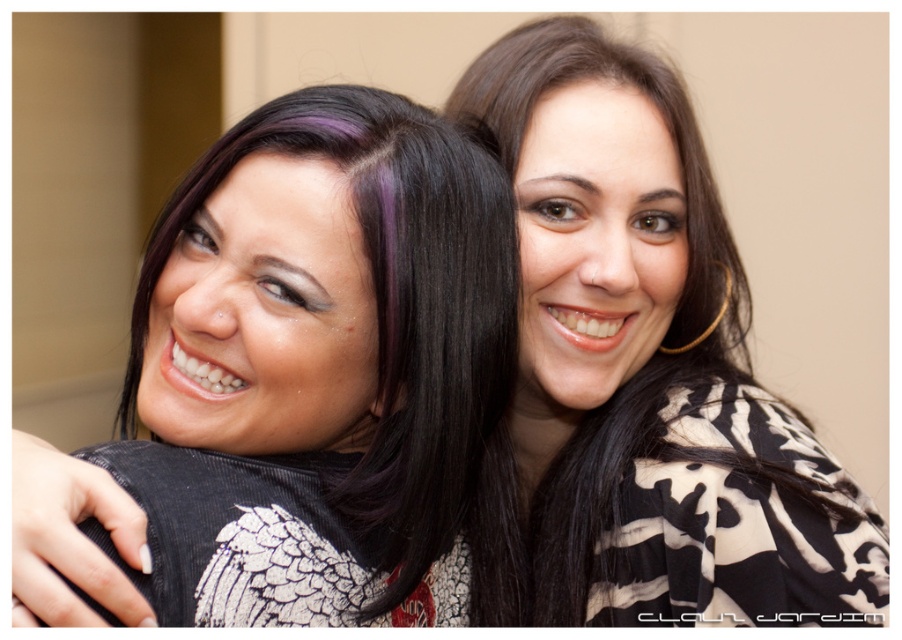
You are a photographer adjusting the lighting for a portrait. You notice the matte black hair at left and the black printed shirt at center. Which object should you focus your light on to ensure it stands out more against the background?

The matte black hair at left is positioned under the black printed shirt at center. To ensure it stands out, focus the light on the matte black hair at left since it is closer to the foreground and might be in shadow beneath the shirt.

You are a photographer trying to adjust the lighting for a portrait. You notice a point at coordinates (318, 368) on the left side of the image. What object does this point correspond to?

The point at coordinates (318, 368) corresponds to the matte black hair at left.